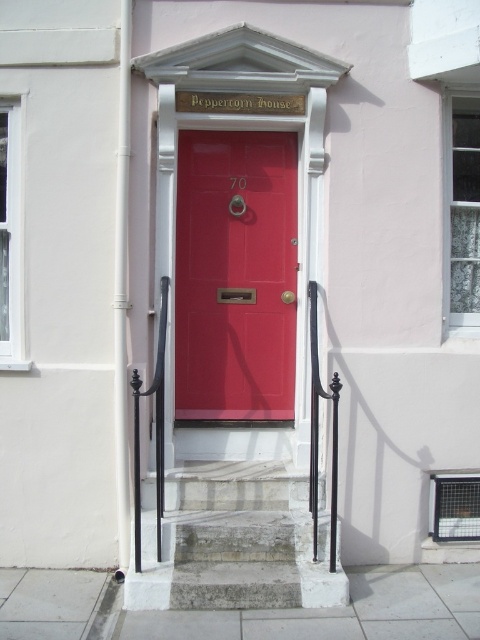
Can you confirm if matte red door at center is thinner than gray stone stairs at center?

Indeed, matte red door at center has a lesser width compared to gray stone stairs at center.

The height and width of the screenshot is (640, 480). What do you see at coordinates (235, 275) in the screenshot? I see `matte red door at center` at bounding box center [235, 275].

Where is `matte red door at center`? This screenshot has width=480, height=640. matte red door at center is located at coordinates click(x=235, y=275).